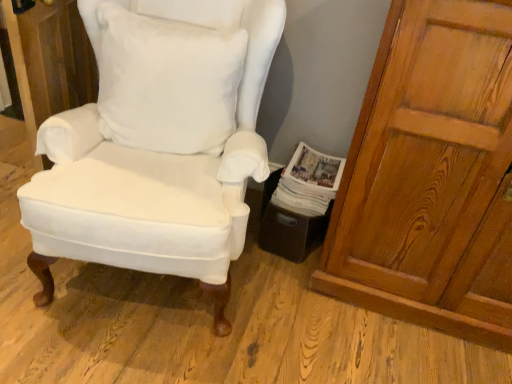
Question: Is matte white cushioned chair at center taller than white cotton pillow at center?

Choices:
 (A) no
 (B) yes

Answer: (B)

Question: Is matte white cushioned chair at center looking in the opposite direction of white cotton pillow at center?

Choices:
 (A) no
 (B) yes

Answer: (B)

Question: Does matte white cushioned chair at center appear on the right side of white cotton pillow at center?

Choices:
 (A) no
 (B) yes

Answer: (A)

Question: Does matte white cushioned chair at center turn towards white cotton pillow at center?

Choices:
 (A) no
 (B) yes

Answer: (B)

Question: Is white cotton pillow at center a part of matte white cushioned chair at center?

Choices:
 (A) no
 (B) yes

Answer: (B)

Question: Does matte white cushioned chair at center have a larger size compared to white cotton pillow at center?

Choices:
 (A) no
 (B) yes

Answer: (B)

Question: Does white cotton pillow at center appear on the left side of wooden door at right?

Choices:
 (A) no
 (B) yes

Answer: (B)

Question: Does white cotton pillow at center have a lesser height compared to wooden door at right?

Choices:
 (A) no
 (B) yes

Answer: (B)

Question: Does white cotton pillow at center have a larger size compared to wooden door at right?

Choices:
 (A) yes
 (B) no

Answer: (B)

Question: Can you confirm if white cotton pillow at center is wider than wooden door at right?

Choices:
 (A) yes
 (B) no

Answer: (B)

Question: Does white cotton pillow at center turn towards wooden door at right?

Choices:
 (A) yes
 (B) no

Answer: (B)

Question: Is white cotton pillow at center positioned beyond the bounds of wooden door at right?

Choices:
 (A) no
 (B) yes

Answer: (B)

Question: Is white paper magazine at lower right wider than white cotton pillow at center?

Choices:
 (A) yes
 (B) no

Answer: (A)